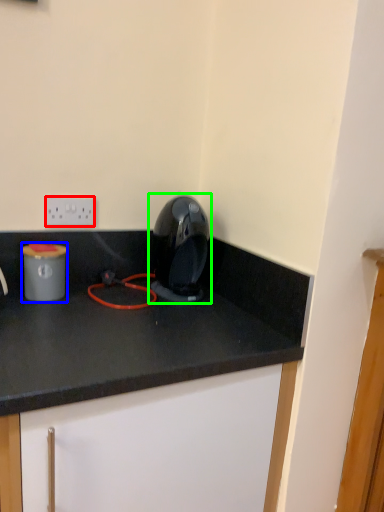
Question: Estimate the real-world distances between objects in this image. Which object is farther from electric outlet (highlighted by a red box), appliance (highlighted by a blue box) or home appliance (highlighted by a green box)?

Choices:
 (A) appliance
 (B) home appliance

Answer: (B)